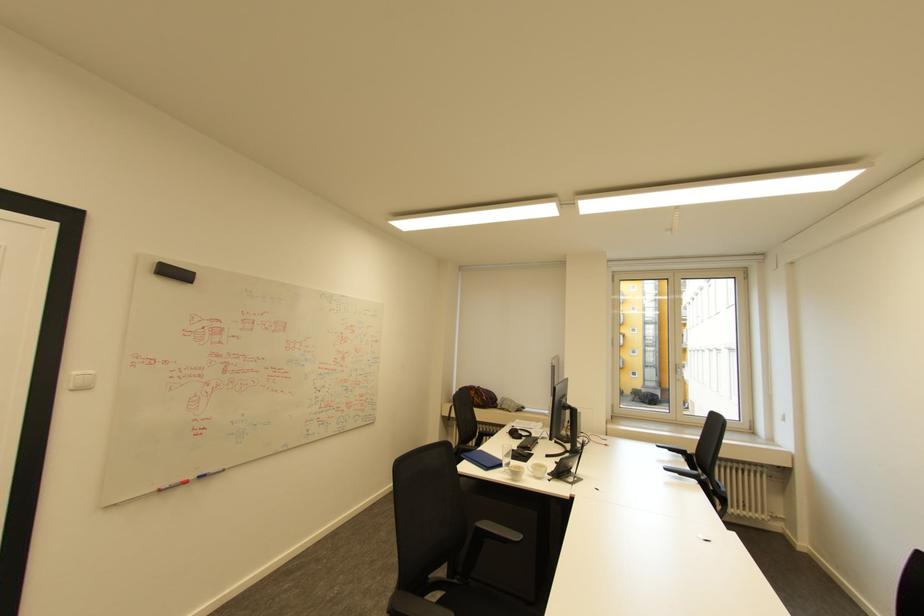
The location [210,472] corresponds to which object?

It corresponds to the blue whiteboard marker in the image.